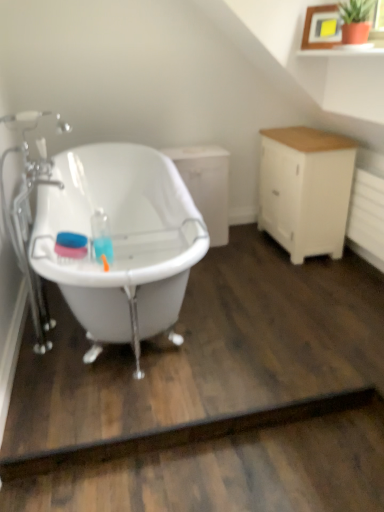
Question: Should I look upward or downward to see white matte cabinet at center, positioned as the 2th cabinetry in right-to-left order?

Choices:
 (A) up
 (B) down

Answer: (A)

Question: Is white wood cabinet at right, marked as the 2th cabinetry in a left-to-right arrangement, bigger than white matte cabinet at center, positioned as the 2th cabinetry in right-to-left order?

Choices:
 (A) no
 (B) yes

Answer: (B)

Question: Is the depth of white wood cabinet at right, the first cabinetry viewed from the right, greater than that of white matte cabinet at center, which ranks as the 1th cabinetry in left-to-right order?

Choices:
 (A) yes
 (B) no

Answer: (B)

Question: Are white wood cabinet at right, marked as the 2th cabinetry in a left-to-right arrangement, and white matte cabinet at center, positioned as the 2th cabinetry in right-to-left order, located far from each other?

Choices:
 (A) no
 (B) yes

Answer: (A)

Question: From the image's perspective, is white wood cabinet at right, marked as the 2th cabinetry in a left-to-right arrangement, located beneath white matte cabinet at center, positioned as the 2th cabinetry in right-to-left order?

Choices:
 (A) yes
 (B) no

Answer: (B)

Question: From the image's perspective, is white wood cabinet at right, the first cabinetry viewed from the right, on white matte cabinet at center, positioned as the 2th cabinetry in right-to-left order?

Choices:
 (A) yes
 (B) no

Answer: (A)

Question: Considering the relative positions of white wood cabinet at right, the first cabinetry viewed from the right, and white matte cabinet at center, positioned as the 2th cabinetry in right-to-left order, in the image provided, is white wood cabinet at right, the first cabinetry viewed from the right, to the right of white matte cabinet at center, positioned as the 2th cabinetry in right-to-left order, from the viewer's perspective?

Choices:
 (A) no
 (B) yes

Answer: (B)

Question: Is white matte cabinet at center, positioned as the 2th cabinetry in right-to-left order, located within white glossy bathtub at left?

Choices:
 (A) yes
 (B) no

Answer: (B)

Question: Can you confirm if white glossy bathtub at left is positioned to the left of white matte cabinet at center, which ranks as the 1th cabinetry in left-to-right order?

Choices:
 (A) yes
 (B) no

Answer: (A)

Question: Is white glossy bathtub at left positioned beyond the bounds of white matte cabinet at center, which ranks as the 1th cabinetry in left-to-right order?

Choices:
 (A) no
 (B) yes

Answer: (B)

Question: Considering the relative positions of white glossy bathtub at left and white matte cabinet at center, positioned as the 2th cabinetry in right-to-left order, in the image provided, is white glossy bathtub at left behind white matte cabinet at center, positioned as the 2th cabinetry in right-to-left order,?

Choices:
 (A) no
 (B) yes

Answer: (A)

Question: Considering the relative sizes of white glossy bathtub at left and white matte cabinet at center, positioned as the 2th cabinetry in right-to-left order, in the image provided, is white glossy bathtub at left bigger than white matte cabinet at center, positioned as the 2th cabinetry in right-to-left order,?

Choices:
 (A) yes
 (B) no

Answer: (A)

Question: Is white glossy bathtub at left far from white matte cabinet at center, which ranks as the 1th cabinetry in left-to-right order?

Choices:
 (A) no
 (B) yes

Answer: (A)

Question: Is white matte cabinet at center, which ranks as the 1th cabinetry in left-to-right order, to the left of white glossy bathtub at left from the viewer's perspective?

Choices:
 (A) yes
 (B) no

Answer: (B)